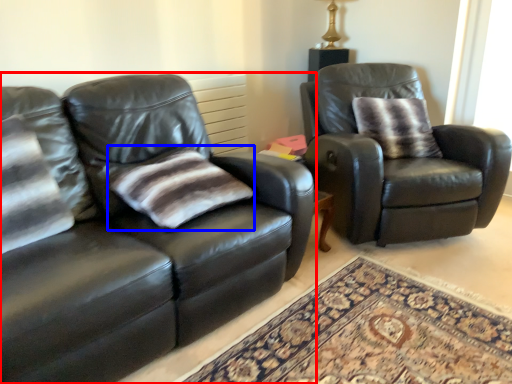
Question: Which object is closer to the camera taking this photo, studio couch (highlighted by a red box) or pillow (highlighted by a blue box)?

Choices:
 (A) studio couch
 (B) pillow

Answer: (A)